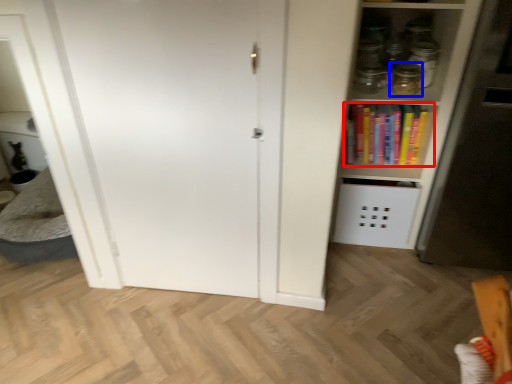
Question: Which of the following is the farthest to the observer, book (highlighted by a red box) or glass jar (highlighted by a blue box)?

Choices:
 (A) book
 (B) glass jar

Answer: (A)